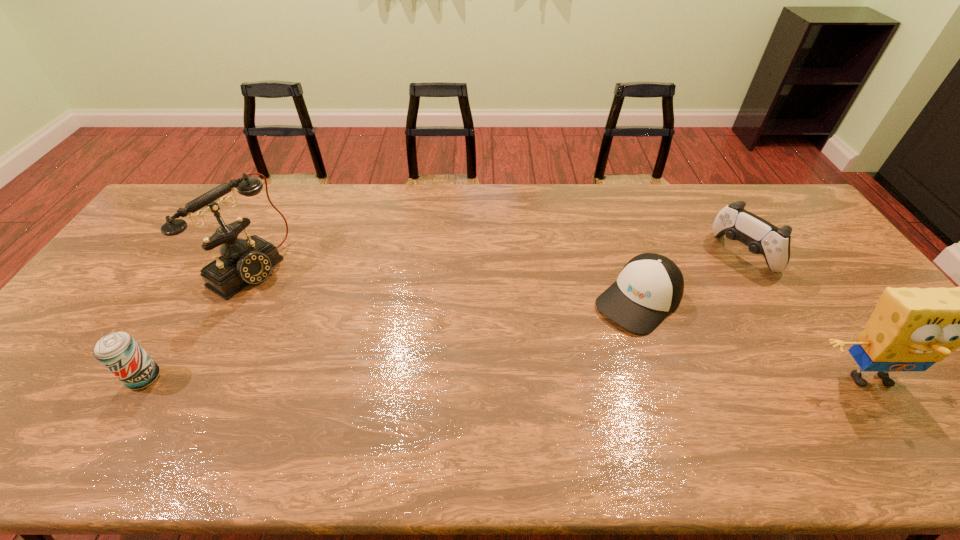
Image resolution: width=960 pixels, height=540 pixels. In the image, there is a desktop. What are the coordinates of `vacant space at the near edge` in the screenshot? It's located at (385, 404).

In the image, there is a desktop. Find the location of `free space at the far left corner`. free space at the far left corner is located at coordinates (195, 189).

In the image, there is a desktop. Identify the location of blank space at the far right corner. (763, 196).

The width and height of the screenshot is (960, 540). I want to click on vacant space that's between the sponge and the telephone, so click(559, 323).

Find the location of a particular element. vacant space that's between the telephone and the cap is located at coordinates (444, 285).

Locate an element on the screen. unoccupied position between the control and the sponge is located at coordinates (804, 316).

Identify the location of empty space that is in between the beer can and the control. 443,316.

Where is `vacant point located between the sponge and the cap`? vacant point located between the sponge and the cap is located at coordinates (754, 340).

I want to click on empty location between the beer can and the cap, so click(392, 339).

This screenshot has height=540, width=960. What are the coordinates of `vacant area between the third object from left to right and the telephone` in the screenshot? It's located at (444, 285).